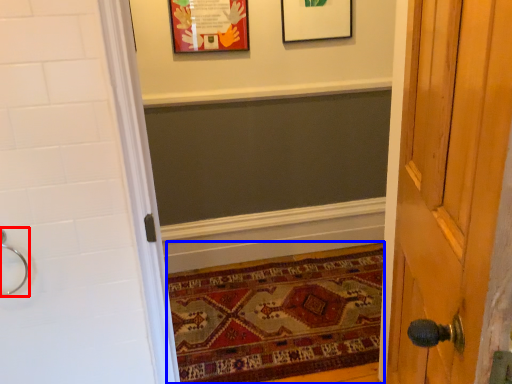
Question: Which object appears farthest to the camera in this image, door handle (highlighted by a red box) or mat (highlighted by a blue box)?

Choices:
 (A) door handle
 (B) mat

Answer: (B)